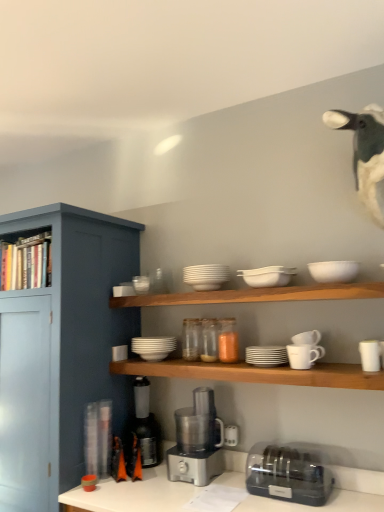
Describe the element at coordinates (370, 355) in the screenshot. The height and width of the screenshot is (512, 384). I see `white matte cup at right, placed as the 1th tableware when sorted from right to left` at that location.

Describe the element at coordinates (267, 276) in the screenshot. This screenshot has width=384, height=512. I see `white matte bowls at center, the sixth tableware in the right-to-left sequence` at that location.

What do you see at coordinates (287, 474) in the screenshot?
I see `clear plastic toaster at lower right` at bounding box center [287, 474].

What do you see at coordinates (191, 339) in the screenshot?
I see `translucent glass jar at center, positioned as the eighth tableware in right-to-left order` at bounding box center [191, 339].

Where is `white matte plates at center, which is counted as the fifth tableware, starting from the left`? This screenshot has width=384, height=512. white matte plates at center, which is counted as the fifth tableware, starting from the left is located at coordinates (266, 355).

Is point (253, 285) farther from camera compared to point (128, 296)?

No, it is in front of (128, 296).

Can you see white matte bowls at center, placed as the fourth tableware when sorted from left to right, touching white matte bowls at upper center, which ranks as the 2th shelf in top-to-bottom order?

No.

Could you tell me if white matte bowls at center, the sixth tableware in the right-to-left sequence, is facing white matte bowls at upper center, which is counted as the second shelf, starting from the bottom?

No, white matte bowls at center, the sixth tableware in the right-to-left sequence, is not oriented towards white matte bowls at upper center, which is counted as the second shelf, starting from the bottom.

Which object is closer to the camera, white matte bowls at center, the sixth tableware in the right-to-left sequence, or white matte bowls at upper center, which is counted as the second shelf, starting from the bottom?

white matte bowls at upper center, which is counted as the second shelf, starting from the bottom.

Is white matte plate at center, arranged as the 7th tableware when viewed from the right, not near clear plastic toaster at lower right?

No, white matte plate at center, arranged as the 7th tableware when viewed from the right, is not far from clear plastic toaster at lower right.

Is white matte plate at center, placed as the 3th tableware when sorted from left to right, positioned beyond the bounds of clear plastic toaster at lower right?

Indeed, white matte plate at center, placed as the 3th tableware when sorted from left to right, is completely outside clear plastic toaster at lower right.

Between white matte plate at center, arranged as the 7th tableware when viewed from the right, and clear plastic toaster at lower right, which one appears on the left side from the viewer's perspective?

white matte plate at center, arranged as the 7th tableware when viewed from the right.

Is point (216, 280) closer or farther from the camera than point (269, 487)?

Point (216, 280) is farther from the camera than point (269, 487).

Which is behind, point (306, 357) or point (341, 265)?

The point (306, 357) is farther.

Is white matte bowl at upper right, arranged as the 2th tableware when viewed from the right, located within white matte mug at right, positioned as the 6th tableware in left-to-right order?

That's incorrect, white matte bowl at upper right, arranged as the 2th tableware when viewed from the right, is not inside white matte mug at right, positioned as the 6th tableware in left-to-right order.

Does white matte mug at right, the 4th tableware from the right, have a lesser height compared to white matte bowl at upper right, the 8th tableware viewed from the left?

No, white matte mug at right, the 4th tableware from the right, is not shorter than white matte bowl at upper right, the 8th tableware viewed from the left.

Visually, is white matte mug at right, positioned as the 6th tableware in left-to-right order, positioned to the left or to the right of white matte bowl at upper right, the 8th tableware viewed from the left?

In the image, white matte mug at right, positioned as the 6th tableware in left-to-right order, appears on the left side of white matte bowl at upper right, the 8th tableware viewed from the left.

From a real-world perspective, is clear plastic toaster at lower right physically above satin silver food processor at center, the 1th coffee machine from the right?

No, from a real-world perspective, clear plastic toaster at lower right is not over satin silver food processor at center, the 1th coffee machine from the right

In the image, is clear plastic toaster at lower right positioned in front of or behind satin silver food processor at center, the 1th coffee machine from the right?

In the image, clear plastic toaster at lower right appears in front of satin silver food processor at center, the 1th coffee machine from the right.

Considering the sizes of white matte cup at right, the 9th tableware from the left, and white matte bowls at upper center, which is counted as the second shelf, starting from the bottom, in the image, is white matte cup at right, the 9th tableware from the left, taller or shorter than white matte bowls at upper center, which is counted as the second shelf, starting from the bottom,?

In the image, white matte cup at right, the 9th tableware from the left, appears to be taller than white matte bowls at upper center, which is counted as the second shelf, starting from the bottom.

Can you confirm if white matte cup at right, the 9th tableware from the left, is positioned to the right of white matte bowls at upper center, which ranks as the 2th shelf in top-to-bottom order?

Indeed, white matte cup at right, the 9th tableware from the left, is positioned on the right side of white matte bowls at upper center, which ranks as the 2th shelf in top-to-bottom order.

From the image's perspective, is white matte cup at right, placed as the 1th tableware when sorted from right to left, over white matte bowls at upper center, which ranks as the 2th shelf in top-to-bottom order?

No, from the image's perspective, white matte cup at right, placed as the 1th tableware when sorted from right to left, is not over white matte bowls at upper center, which ranks as the 2th shelf in top-to-bottom order.

Is the depth of white matte cup at right, the 9th tableware from the left, less than that of white matte bowls at upper center, which is counted as the second shelf, starting from the bottom?

No.

Is metallic silver coffee machine at lower center, marked as the 1th coffee machine in a left-to-right arrangement, facing away from translucent glass jar at center, the second tableware in the left-to-right sequence?

No, metallic silver coffee machine at lower center, marked as the 1th coffee machine in a left-to-right arrangement, is not facing the opposite direction of translucent glass jar at center, the second tableware in the left-to-right sequence.

How far apart are metallic silver coffee machine at lower center, which is the second coffee machine in right-to-left order, and translucent glass jar at center, the second tableware in the left-to-right sequence?

A distance of 16.81 inches exists between metallic silver coffee machine at lower center, which is the second coffee machine in right-to-left order, and translucent glass jar at center, the second tableware in the left-to-right sequence.

How many degrees apart are the facing directions of metallic silver coffee machine at lower center, marked as the 1th coffee machine in a left-to-right arrangement, and translucent glass jar at center, positioned as the eighth tableware in right-to-left order?

metallic silver coffee machine at lower center, marked as the 1th coffee machine in a left-to-right arrangement, and translucent glass jar at center, positioned as the eighth tableware in right-to-left order, are facing 2.44 degrees away from each other.

Considering the relative positions of metallic silver coffee machine at lower center, which is the second coffee machine in right-to-left order, and translucent glass jar at center, positioned as the eighth tableware in right-to-left order, in the image provided, is metallic silver coffee machine at lower center, which is the second coffee machine in right-to-left order, to the left of translucent glass jar at center, positioned as the eighth tableware in right-to-left order, from the viewer's perspective?

Correct, you'll find metallic silver coffee machine at lower center, which is the second coffee machine in right-to-left order, to the left of translucent glass jar at center, positioned as the eighth tableware in right-to-left order.

Considering the positions of points (268, 297) and (208, 415), is point (268, 297) farther from camera compared to point (208, 415)?

That is False.

Which is in front, white matte bowls at upper center, which is counted as the second shelf, starting from the bottom, or satin silver food processor at center, acting as the 2th coffee machine starting from the left?

white matte bowls at upper center, which is counted as the second shelf, starting from the bottom.

How many degrees apart are the facing directions of white matte bowls at upper center, which ranks as the 2th shelf in top-to-bottom order, and satin silver food processor at center, the 1th coffee machine from the right?

white matte bowls at upper center, which ranks as the 2th shelf in top-to-bottom order, and satin silver food processor at center, the 1th coffee machine from the right, are facing 2.99 degrees away from each other.

Is the surface of white matte bowls at upper center, which is counted as the second shelf, starting from the bottom, in direct contact with satin silver food processor at center, acting as the 2th coffee machine starting from the left?

No, white matte bowls at upper center, which is counted as the second shelf, starting from the bottom, is not touching satin silver food processor at center, acting as the 2th coffee machine starting from the left.

Where is `shelf that is the 1st object to the left of the white matte bowls at center, the sixth tableware in the right-to-left sequence, starting at the anchor`? shelf that is the 1st object to the left of the white matte bowls at center, the sixth tableware in the right-to-left sequence, starting at the anchor is located at coordinates (256, 295).

Where is `tableware that is the 6th one when counting backward from the clear plastic toaster at lower right`? The image size is (384, 512). tableware that is the 6th one when counting backward from the clear plastic toaster at lower right is located at coordinates (206, 276).

Estimate the real-world distances between objects in this image. Which object is closer to translucent glass jar at center, positioned as the eighth tableware in right-to-left order, satin silver food processor at center, acting as the 2th coffee machine starting from the left, or white fabric duck at upper right?

The object closer to translucent glass jar at center, positioned as the eighth tableware in right-to-left order, is satin silver food processor at center, acting as the 2th coffee machine starting from the left.

When comparing their distances from clear plastic toaster at lower right, does white fabric duck at upper right or wooden bookshelf at left, the third shelf from the bottom, seem further?

wooden bookshelf at left, the third shelf from the bottom, lies further to clear plastic toaster at lower right than the other object.

Estimate the real-world distances between objects in this image. Which object is closer to white matte cups at center, arranged as the 3th shelf when viewed from the top, translucent glass jar at center, positioned as the eighth tableware in right-to-left order, or white matte bowls at center, the sixth tableware in the right-to-left sequence?

translucent glass jar at center, positioned as the eighth tableware in right-to-left order.

Estimate the real-world distances between objects in this image. Which object is further from white matte bowls at upper center, which is counted as the second shelf, starting from the bottom, matte blue cabinet at left or white matte mug at upper right, which is the third tableware in right-to-left order?

Based on the image, matte blue cabinet at left appears to be further to white matte bowls at upper center, which is counted as the second shelf, starting from the bottom.

Based on their spatial positions, is satin silver food processor at center, the 1th coffee machine from the right, or white matte cups at center, which is counted as the first shelf, starting from the bottom, further from white matte plate at center, arranged as the 7th tableware when viewed from the right?

satin silver food processor at center, the 1th coffee machine from the right, is positioned further to the anchor white matte plate at center, arranged as the 7th tableware when viewed from the right.

From the image, which object appears to be nearer to white fabric duck at upper right, white matte mug at upper right, which is the 7th tableware in left-to-right order, or white matte plate at center, placed as the 3th tableware when sorted from left to right?

white matte mug at upper right, which is the 7th tableware in left-to-right order, is closer to white fabric duck at upper right.

Based on their spatial positions, is white matte bowls at upper center, which is counted as the second shelf, starting from the bottom, or matte blue cabinet at left further from satin silver food processor at center, acting as the 2th coffee machine starting from the left?

white matte bowls at upper center, which is counted as the second shelf, starting from the bottom, lies further to satin silver food processor at center, acting as the 2th coffee machine starting from the left, than the other object.

Estimate the real-world distances between objects in this image. Which object is further from matte blue cabinet at left, white matte cups at center, which is counted as the first shelf, starting from the bottom, or white fabric duck at upper right?

Based on the image, white fabric duck at upper right appears to be further to matte blue cabinet at left.

What are the coordinates of `coffee machine located between metallic silver coffee machine at lower center, marked as the 1th coffee machine in a left-to-right arrangement, and white matte mug at right, the 4th tableware from the right, in the left-right direction` in the screenshot? It's located at (x=197, y=441).

Locate an element on the screen. Image resolution: width=384 pixels, height=512 pixels. coffee machine positioned between white matte cups at center, arranged as the 3th shelf when viewed from the top, and white matte bowls at center, which ranks as the 9th tableware in right-to-left order, from near to far is located at coordinates (197, 441).

The height and width of the screenshot is (512, 384). I want to click on cabinetry that lies between wooden bookshelf at left, arranged as the 1th shelf when viewed from the top, and metallic silver coffee machine at lower center, marked as the 1th coffee machine in a left-to-right arrangement, from top to bottom, so click(x=62, y=350).

This screenshot has width=384, height=512. Find the location of `shelf between white matte bowls at upper center, which is counted as the second shelf, starting from the bottom, and metallic silver coffee machine at lower center, marked as the 1th coffee machine in a left-to-right arrangement, in the up-down direction`. shelf between white matte bowls at upper center, which is counted as the second shelf, starting from the bottom, and metallic silver coffee machine at lower center, marked as the 1th coffee machine in a left-to-right arrangement, in the up-down direction is located at coordinates (256, 373).